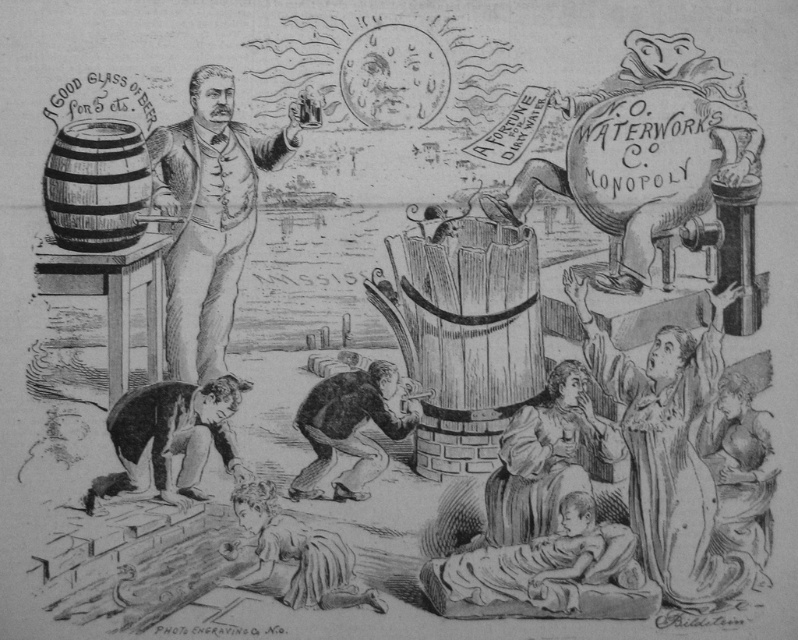
You are an inspector checking the layout of this satirical illustration. There are two points marked in the image. The first point is at coordinate point (613, 548) and the second is at coordinate point (310, 428). From your vantage point, which point is closer to you?

Point (613, 548) is in front of point (310, 428), so the first point is closer to you.

You are a photographer standing at the center of the image. You need to take a photo of the dark skin child at lower center. Which direction should you move to get the child in the frame?

The dark skin child at lower center is located at point 0.894 on the x axis and 0.684 on the y axis. Since the photographer is at the center of the image, they should move to the right and slightly upwards to position the child in the frame.